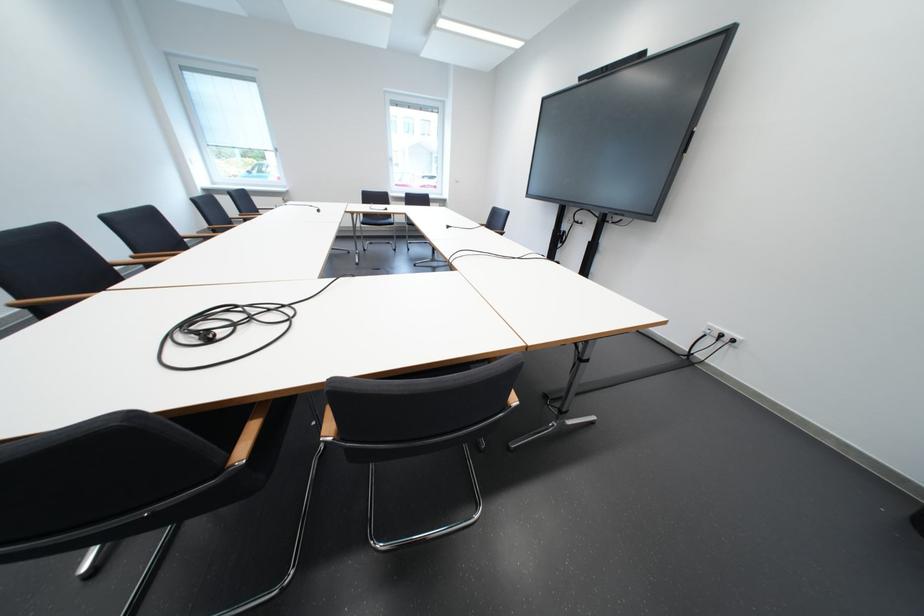
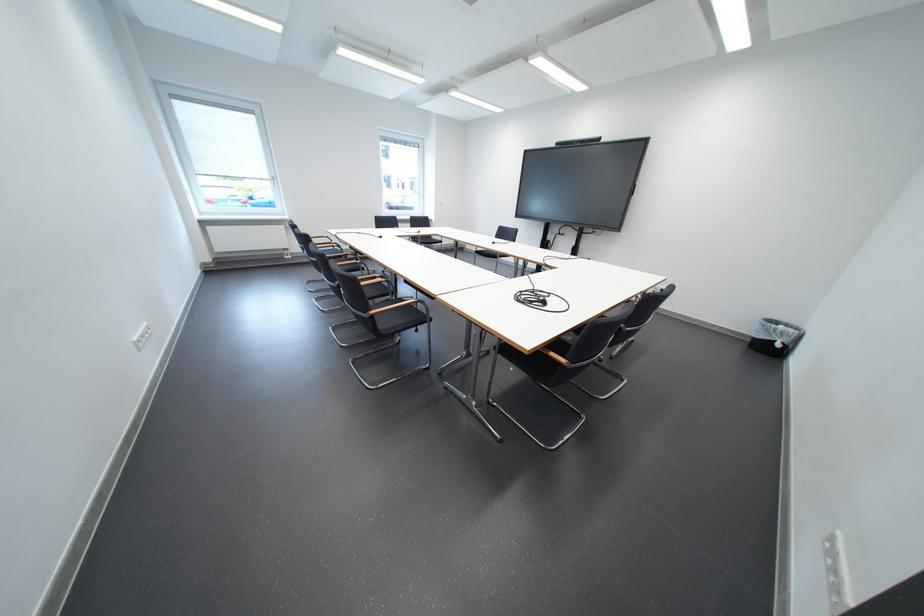
Where in the second image is the point corresponding to (249,309) from the first image?

(533, 294)